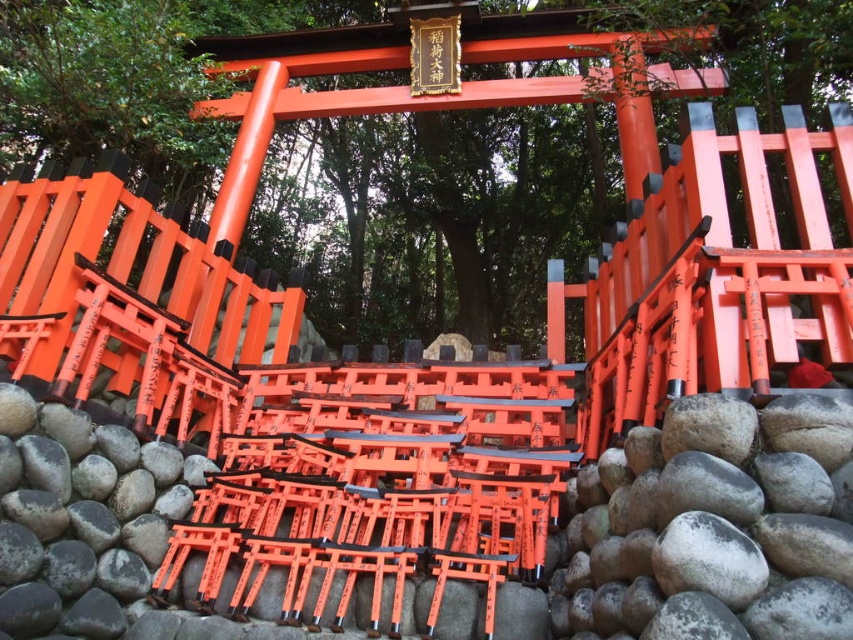
Is gray/rough rock at lower center shorter than smooth gray rock at center?

Indeed, gray/rough rock at lower center has a lesser height compared to smooth gray rock at center.

How much distance is there between gray/rough rock at lower center and smooth gray rock at center?

gray/rough rock at lower center is 2.89 meters from smooth gray rock at center.

Is point (833, 557) closer to viewer compared to point (9, 618)?

Yes, it is.

You are a GUI agent. You are given a task and a screenshot of the screen. Output one action in this format:
    pyautogui.click(x=<x>, y=<y>)
    Task: Click on the gray/rough rock at lower center
    Image resolution: width=853 pixels, height=640 pixels.
    Given the screenshot: What is the action you would take?
    pyautogui.click(x=714, y=525)